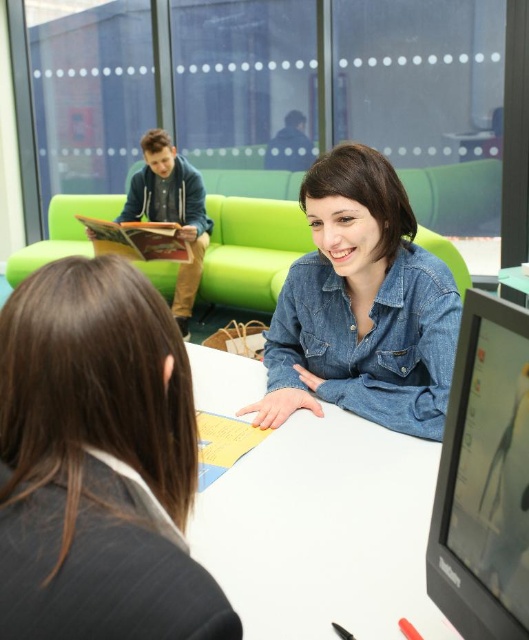
You are standing in the library and want to locate two specific points on the table. The first point is at coordinate point (x=86, y=572) and the second is at point (x=323, y=500). Which of these points is nearer to you?

Point (x=86, y=572) is closer to the viewer than point (x=323, y=500).

You are a student who needs to place a 20 inch laptop on the white glossy table at center. There is a denim jacket at center on the table. Can the laptop fit on the table without overlapping the jacket?

The denim jacket at center is 19.59 inches from the white glossy table at center. Since the laptop is 20 inches long, it would slightly overlap the denim jacket at center, making it difficult to place the laptop without overlapping.

You are a person sitting at the white table in the image. You want to reach the black glossy monitor at lower right without moving your chair. Can you comfortably reach it if your arm can extend 2 feet?

The distance between you and the black glossy monitor at lower right is 18.36 inches, which is less than 2 feet. Therefore, you can comfortably reach it without moving your chair.